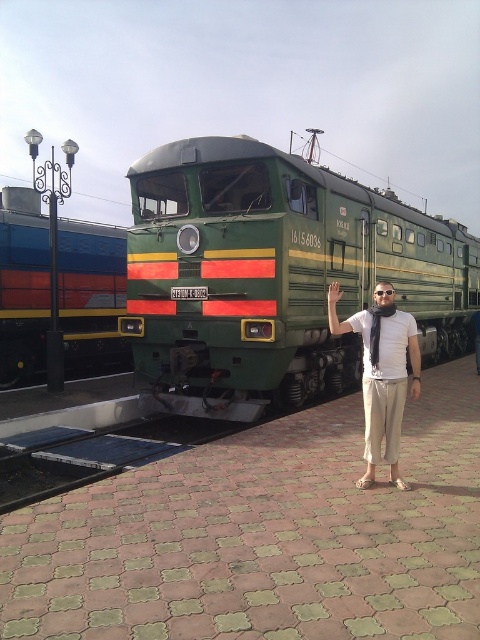
Can you confirm if metallic green train at left is shorter than matte green scarf at center?

In fact, metallic green train at left may be taller than matte green scarf at center.

Does metallic green train at left appear under matte green scarf at center?

No, metallic green train at left is not below matte green scarf at center.

This screenshot has height=640, width=480. Find the location of `metallic green train at left`. metallic green train at left is located at coordinates (91, 291).

Locate an element on the screen. Image resolution: width=480 pixels, height=640 pixels. metallic green train at left is located at coordinates (91, 291).

In the scene shown: Who is taller, matte white shirt at center or matte green scarf at center?

matte white shirt at center is taller.

Does matte white shirt at center have a greater height compared to matte green scarf at center?

Yes, matte white shirt at center is taller than matte green scarf at center.

Is point (404, 349) positioned after point (477, 317)?

That is False.

The image size is (480, 640). What are the coordinates of `matte white shirt at center` in the screenshot? It's located at (382, 372).

Is green matte train at center below matte white shirt at center?

Actually, green matte train at center is above matte white shirt at center.

Describe the element at coordinates (274, 275) in the screenshot. I see `green matte train at center` at that location.

Does point (230, 220) come behind point (400, 317)?

Yes, it is.

Locate an element on the screen. This screenshot has height=640, width=480. green matte train at center is located at coordinates (274, 275).